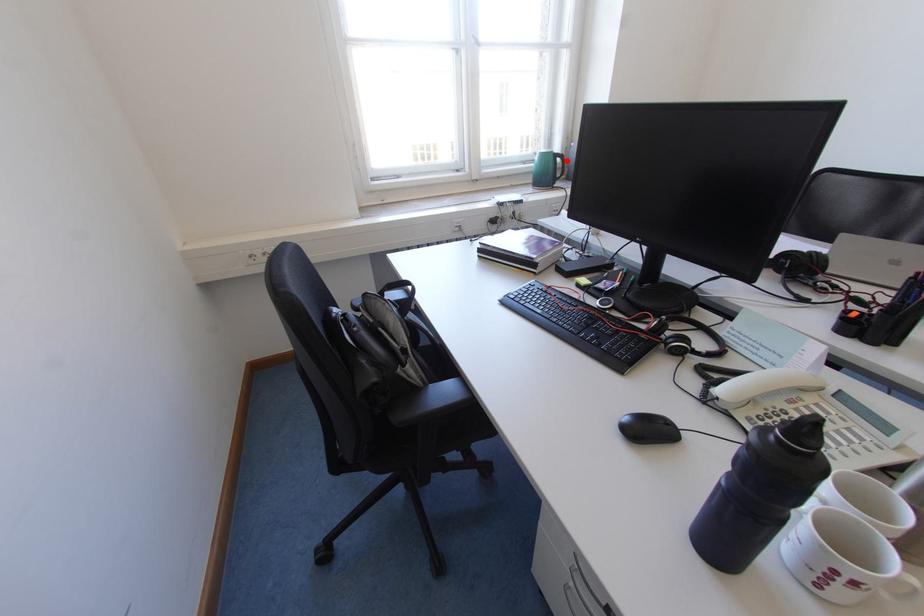
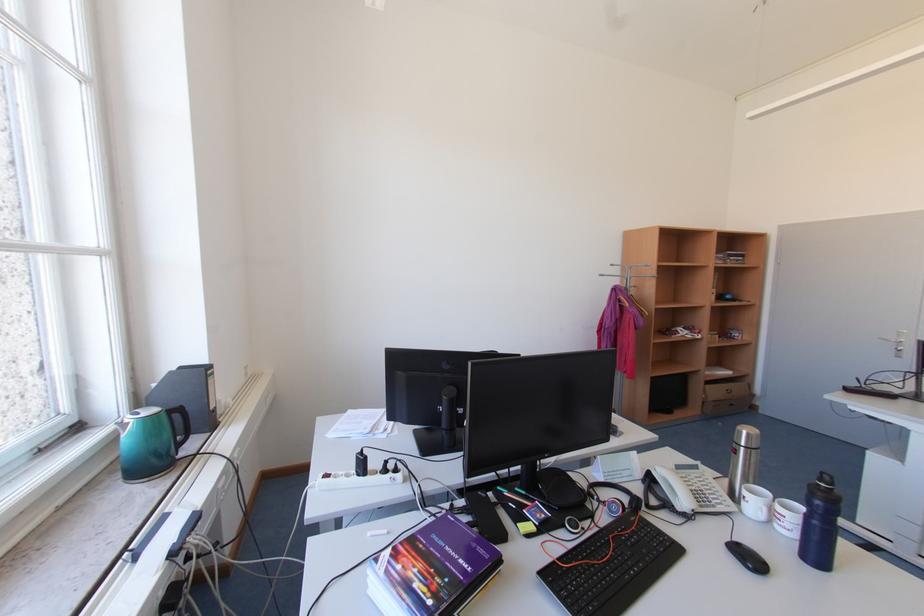
Question: I am providing you with two images of the same scene from different viewpoints. A red point is marked on the first image. Can you still see the location of the red point in image 2?

Choices:
 (A) Yes
 (B) No

Answer: (A)